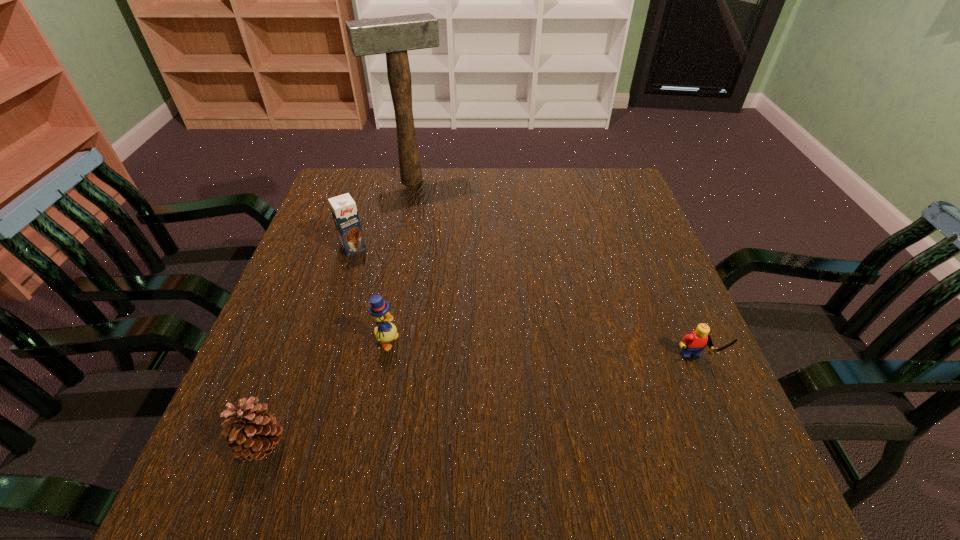
The image size is (960, 540). Find the location of `chocolate milk that is at the left edge`. chocolate milk that is at the left edge is located at coordinates (344, 211).

Identify the location of mallet at the left edge. This screenshot has height=540, width=960. (396, 35).

The width and height of the screenshot is (960, 540). I want to click on object at the right edge, so click(693, 343).

At what (x,y) coordinates should I click in order to perform the action: click on object that is at the far left corner. Please return your answer as a coordinate pair (x, y). The height and width of the screenshot is (540, 960). Looking at the image, I should click on (396, 35).

Locate an element on the screen. The width and height of the screenshot is (960, 540). object present at the near left corner is located at coordinates (252, 434).

Where is `free region at the far edge`? The width and height of the screenshot is (960, 540). free region at the far edge is located at coordinates (396, 178).

Image resolution: width=960 pixels, height=540 pixels. In order to click on vacant space at the near edge of the desktop in this screenshot , I will do `click(463, 425)`.

Find the location of a particular element. The height and width of the screenshot is (540, 960). vacant point at the left edge is located at coordinates coord(327,329).

This screenshot has height=540, width=960. I want to click on vacant space at the right edge, so click(x=633, y=316).

The width and height of the screenshot is (960, 540). In order to click on vacant space at the far left corner of the desktop in this screenshot , I will do `click(354, 185)`.